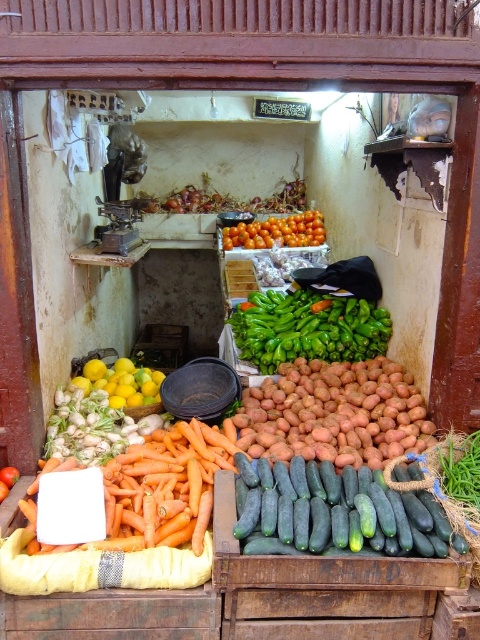
In the scene shown: You are a customer at the vegetable stall and want to find the green smooth cucumber at center. Based on the coordinates provided in the scene description, can you determine its exact position relative to the other vegetables?

The green smooth cucumber at center is located at point coordinates 0.802 on the x and 0.700 on the y axis according to the scene description.

You are a customer at the vegetable stall and want to pick up the orange matte tomatoes at center. Can you reach them without moving the green smooth cucumber at center?

The green smooth cucumber at center is in front of the orange matte tomatoes at center, so you cannot reach the orange matte tomatoes at center without moving the cucumber first.

You are a customer at the vegetable stall and want to buy both the green glossy bell peppers at center and the orange matte tomatoes at center. Which one should you pick up first if you want to start from the left side of the stall?

You should pick up the orange matte tomatoes at center first because the green glossy bell peppers at center are to the right of them, so the tomatoes are on the left side.